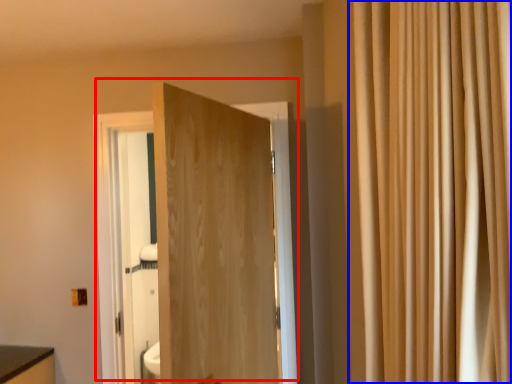
Question: Among these objects, which one is nearest to the camera, door (highlighted by a red box) or curtain (highlighted by a blue box)?

Choices:
 (A) door
 (B) curtain

Answer: (B)